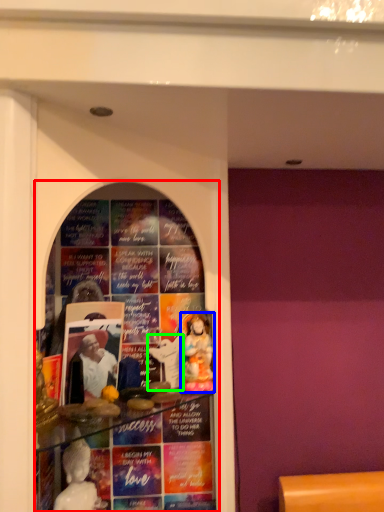
Question: Considering the real-world distances, which object is closest to shop window (highlighted by a red box)? person (highlighted by a blue box) or toy (highlighted by a green box).

Choices:
 (A) person
 (B) toy

Answer: (A)